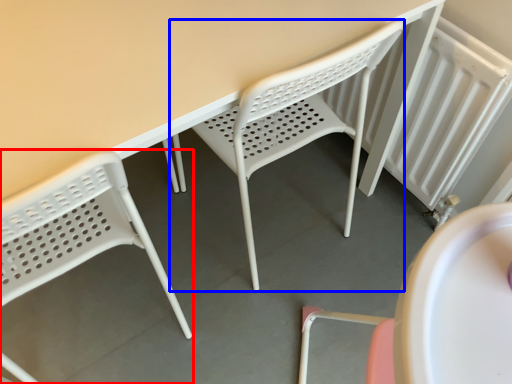
Question: Among these objects, which one is nearest to the camera, chair (highlighted by a red box) or chair (highlighted by a blue box)?

Choices:
 (A) chair
 (B) chair

Answer: (A)